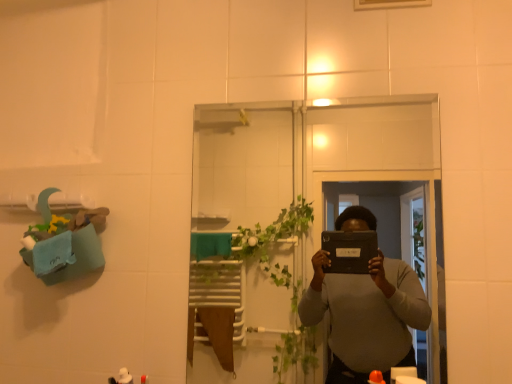
Locate an element on the screen. clear glass mirror at center is located at coordinates (292, 203).

Measure the distance between clear glass mirror at center and camera.

clear glass mirror at center is 1.90 meters from camera.

The height and width of the screenshot is (384, 512). What do you see at coordinates (292, 203) in the screenshot?
I see `clear glass mirror at center` at bounding box center [292, 203].

Image resolution: width=512 pixels, height=384 pixels. What are the coordinates of `clear glass mirror at center` in the screenshot? It's located at (292, 203).